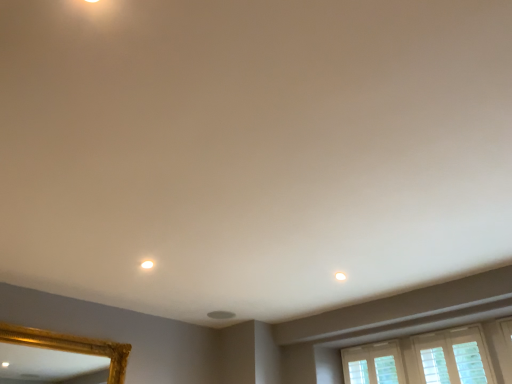
Question: From the image's perspective, is white matte light at upper center positioned above or below white glossy light fixture at upper center?

Choices:
 (A) below
 (B) above

Answer: (A)

Question: Is point (337, 274) closer or farther from the camera than point (151, 264)?

Choices:
 (A) closer
 (B) farther

Answer: (B)

Question: Considering their positions, is white matte light at upper center located in front of or behind white glossy light fixture at upper center?

Choices:
 (A) front
 (B) behind

Answer: (B)

Question: In terms of size, does white glossy light fixture at upper center appear bigger or smaller than white matte light at upper center?

Choices:
 (A) small
 (B) big

Answer: (B)

Question: Is white glossy light fixture at upper center taller or shorter than white matte light at upper center?

Choices:
 (A) short
 (B) tall

Answer: (B)

Question: From a real-world perspective, is white glossy light fixture at upper center physically located above or below white matte light at upper center?

Choices:
 (A) above
 (B) below

Answer: (B)

Question: From the image's perspective, relative to white matte light at upper center, is white glossy light fixture at upper center above or below?

Choices:
 (A) below
 (B) above

Answer: (B)